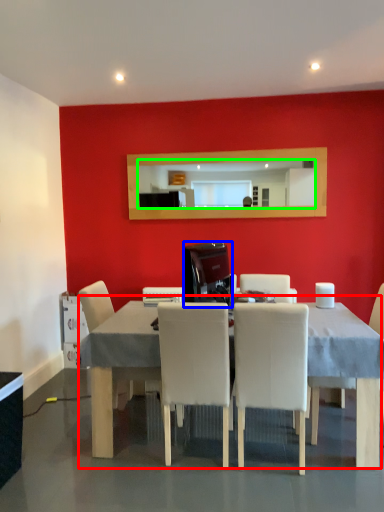
Question: Which object is the farthest from table (highlighted by a red box)? Choose among these: appliance (highlighted by a blue box) or mirror (highlighted by a green box).

Choices:
 (A) appliance
 (B) mirror

Answer: (B)